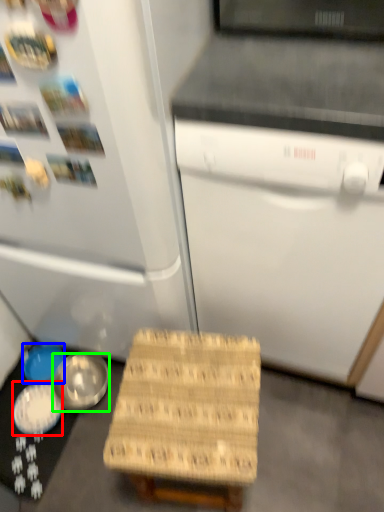
Question: Based on their relative distances, which object is nearer to bowl (highlighted by a red box)? Choose from bowl (highlighted by a blue box) and bowl (highlighted by a green box).

Choices:
 (A) bowl
 (B) bowl

Answer: (B)